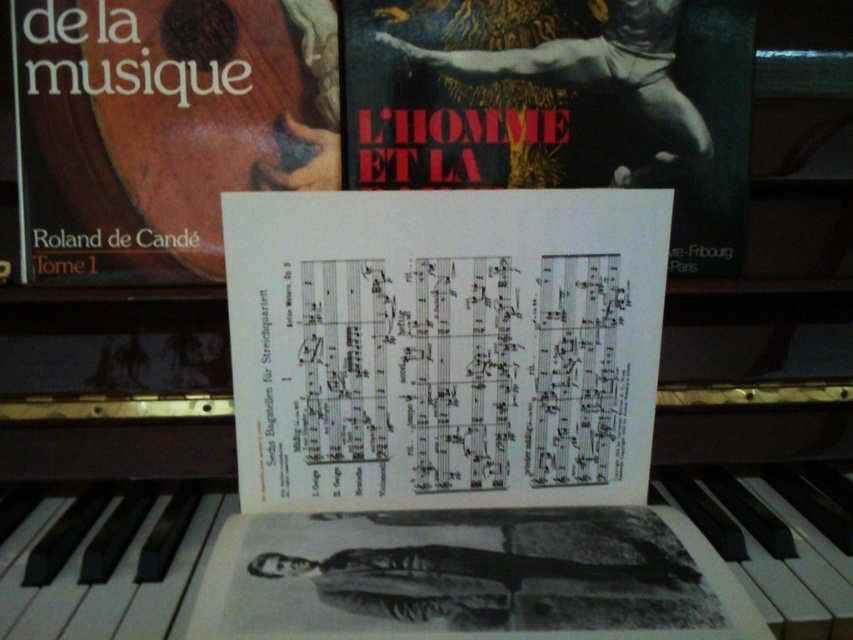
Question: Which of the following is the farthest from the observer?

Choices:
 (A) (213, 161)
 (B) (427, 36)

Answer: (B)

Question: Is white paper music sheet at upper center smaller than matte brown book at center?

Choices:
 (A) yes
 (B) no

Answer: (B)

Question: Is white paper music sheet at center positioned behind matte brown book at center?

Choices:
 (A) no
 (B) yes

Answer: (A)

Question: Which point is farther to the camera?

Choices:
 (A) (703, 173)
 (B) (277, 289)
 (C) (212, 209)

Answer: (A)

Question: Which is farther from the matte brown book at center?

Choices:
 (A) white paper music sheet at center
 (B) white paper music sheet at upper center

Answer: (A)

Question: Can you confirm if white paper music sheet at center is positioned to the left of white paper music sheet at upper center?

Choices:
 (A) no
 (B) yes

Answer: (B)